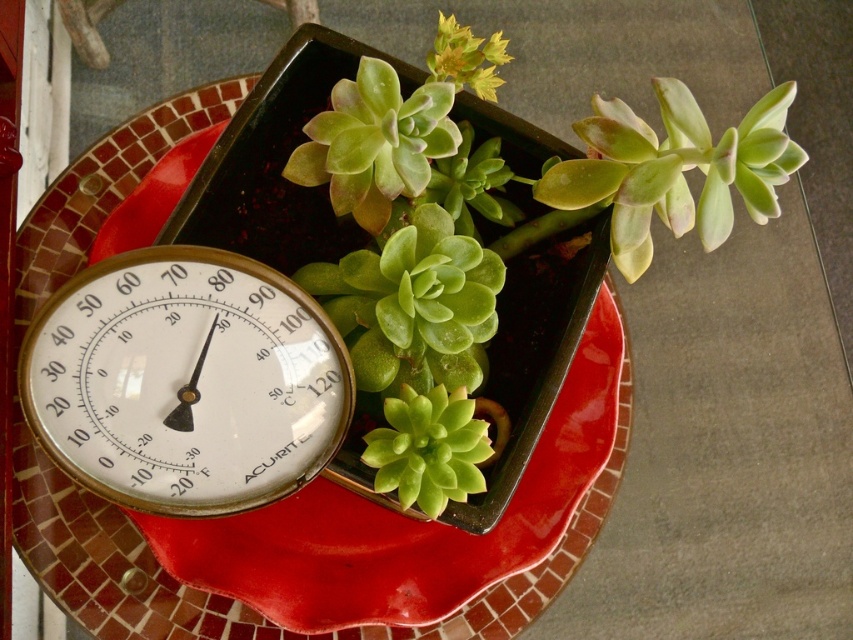
Between gold metallic thermometer at lower left and green succulent at center, which one appears on the left side from the viewer's perspective?

gold metallic thermometer at lower left

Can you confirm if gold metallic thermometer at lower left is smaller than green succulent at center?

Incorrect, gold metallic thermometer at lower left is not smaller in size than green succulent at center.

Locate an element on the screen. Image resolution: width=853 pixels, height=640 pixels. gold metallic thermometer at lower left is located at coordinates (184, 381).

Does matte ceramic platter at center lie behind green succulent at center?

Yes.

Who is higher up, matte ceramic platter at center or green succulent at center?

matte ceramic platter at center is higher up.

Where is `matte ceramic platter at center`? Image resolution: width=853 pixels, height=640 pixels. matte ceramic platter at center is located at coordinates (126, 557).

How far apart are matte ceramic platter at center and gold metallic thermometer at lower left?

matte ceramic platter at center and gold metallic thermometer at lower left are 8.43 inches apart.

Is matte ceramic platter at center below gold metallic thermometer at lower left?

Indeed, matte ceramic platter at center is positioned under gold metallic thermometer at lower left.

Where is `matte ceramic platter at center`? Image resolution: width=853 pixels, height=640 pixels. matte ceramic platter at center is located at coordinates (126, 557).